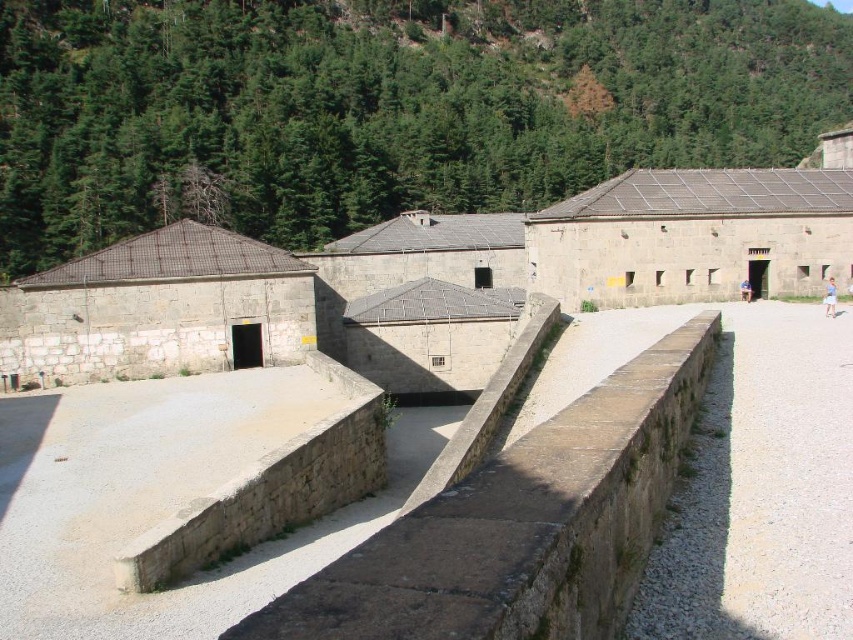
You are standing in the courtyard of the historical stone structure and want to locate the brown stone ledge at center. According to the coordinates provided, where would you find it?

The brown stone ledge at center is located at point coordinates of (x=523, y=524).

You are a hiker who has just arrived at the historical stone structure. You see a brown stone ledge at center and blue denim jeans at center. Which object can you sit on?

The brown stone ledge at center can be sat on because it is bigger than the blue denim jeans at center.